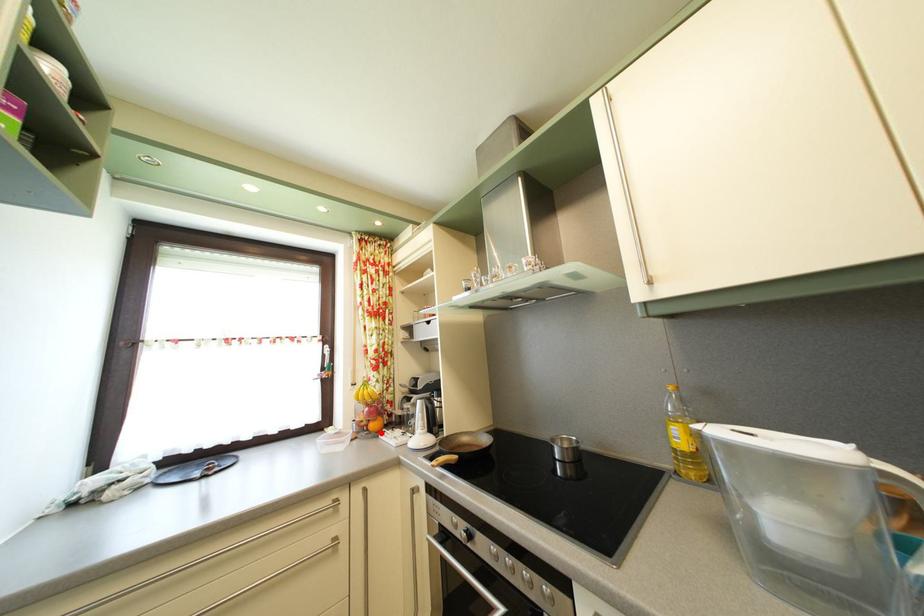
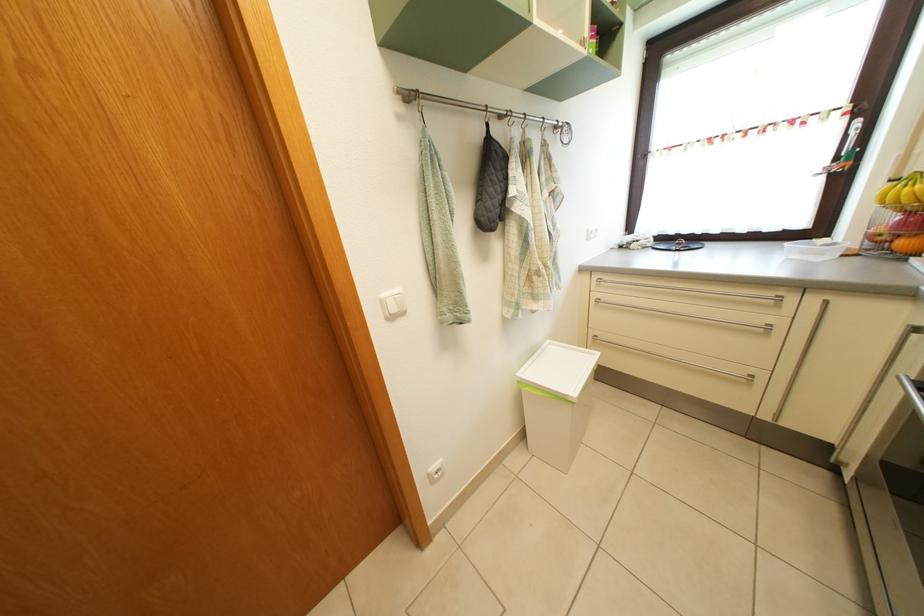
Locate, in the second image, the point that corresponds to the highlighted location in the first image.

(910, 252)